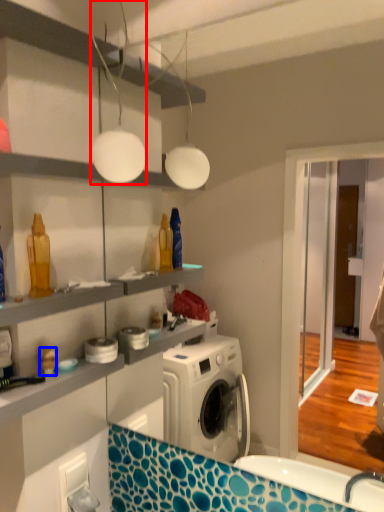
Question: Which object appears farthest to the camera in this image, light fixture (highlighted by a red box) or toy (highlighted by a blue box)?

Choices:
 (A) light fixture
 (B) toy

Answer: (B)